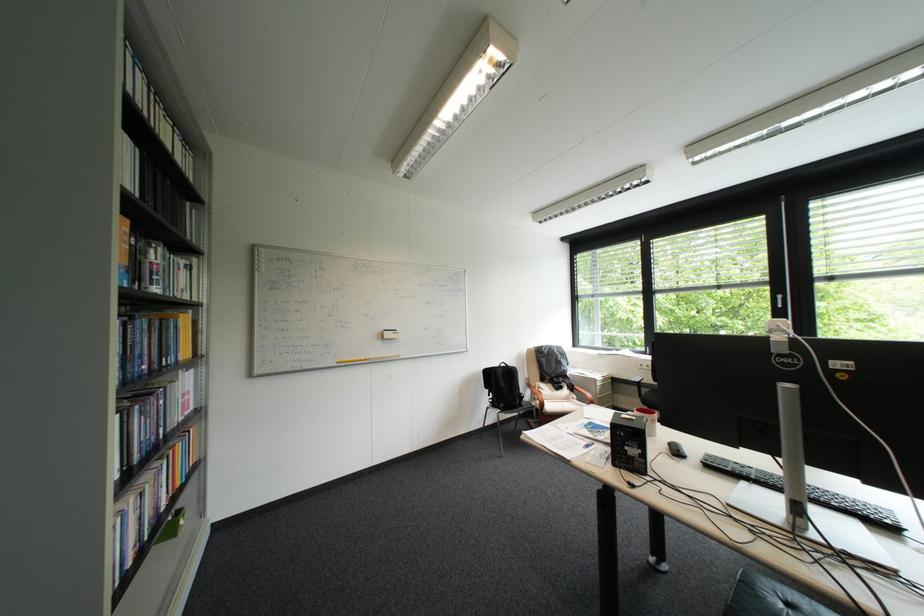
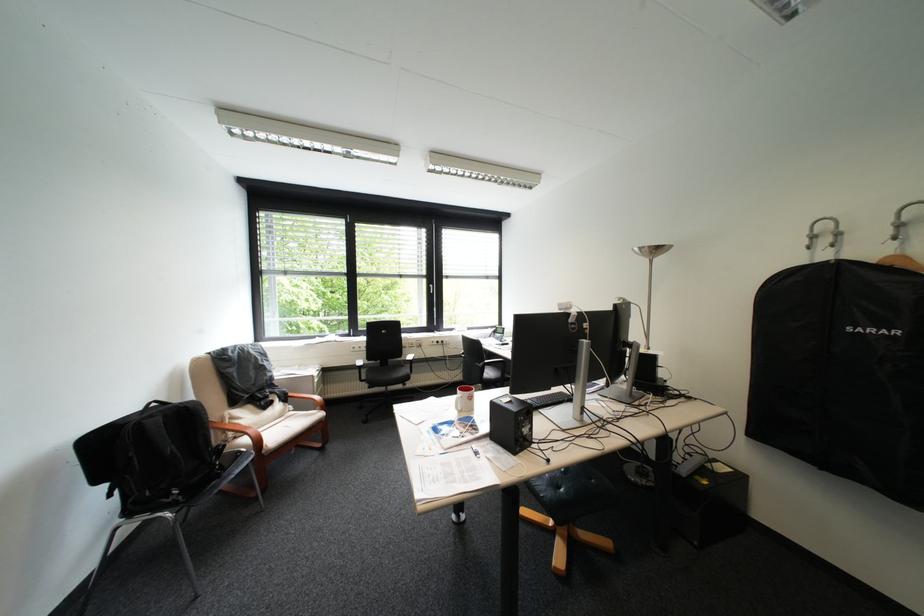
The point at (524,369) is marked in the first image. Where is the corresponding point in the second image?

(199, 407)